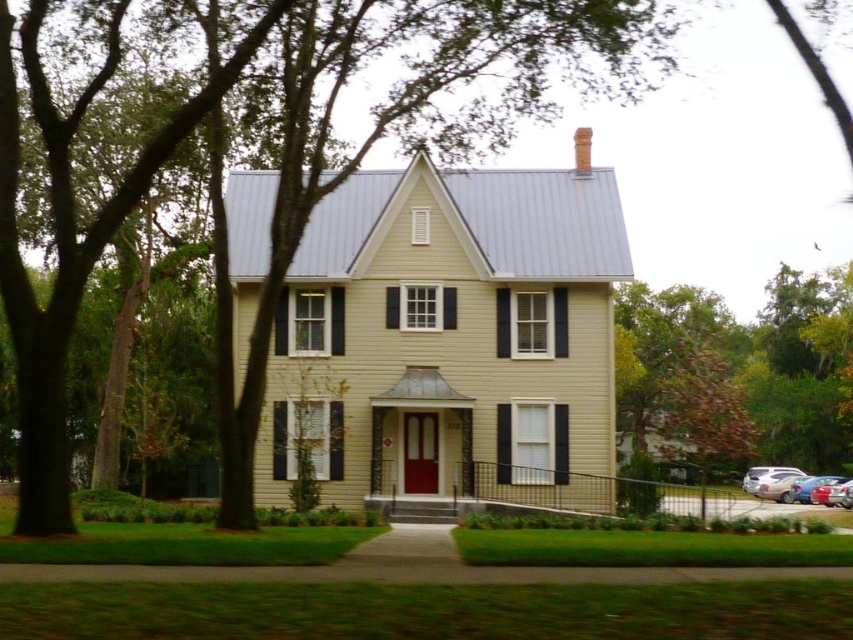
Question: Which point is closer to the camera?

Choices:
 (A) (318, 172)
 (B) (766, 497)
 (C) (824, 484)

Answer: (A)

Question: Which point is closer to the camera?

Choices:
 (A) green leafy tree at center
 (B) metallic red sedan at lower right

Answer: (A)

Question: Among these objects, which one is nearest to the camera?

Choices:
 (A) metallic red sedan at lower right
 (B) metallic silver sedan at lower right
 (C) green leafy tree at center

Answer: (C)

Question: Is green leafy tree at center to the left of metallic red sedan at lower right from the viewer's perspective?

Choices:
 (A) no
 (B) yes

Answer: (B)

Question: Can you confirm if metallic silver sedan at lower right is positioned to the left of metallic red sedan at lower right?

Choices:
 (A) no
 (B) yes

Answer: (B)

Question: Can you confirm if green leafy tree at center is positioned below metallic red sedan at lower right?

Choices:
 (A) yes
 (B) no

Answer: (B)